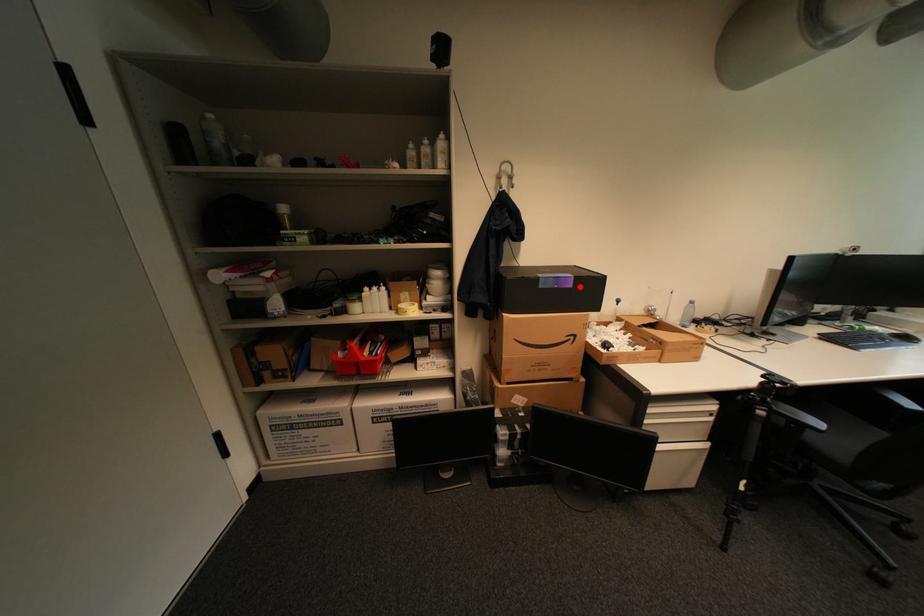
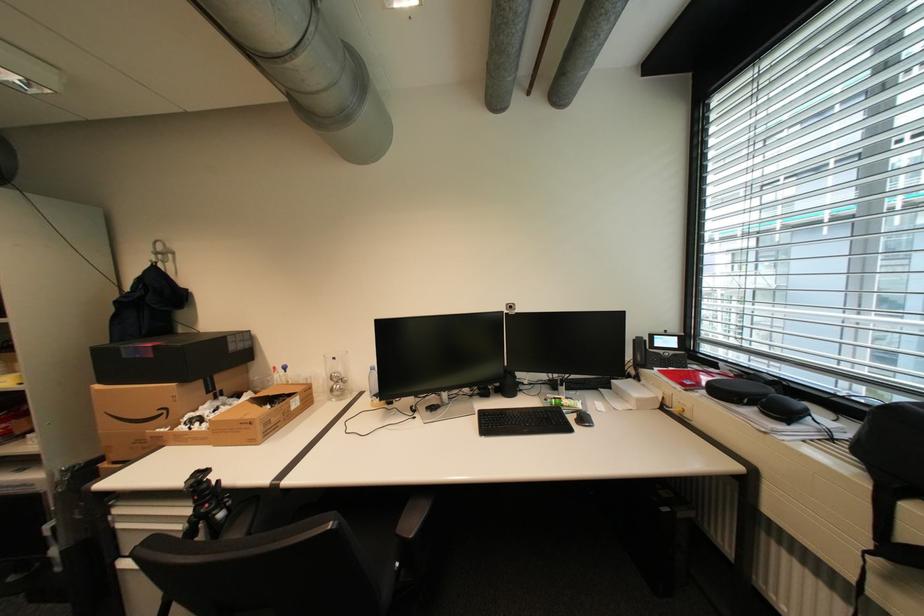
Where in the second image is the point corresponding to the highlighted location from the first image?

(161, 357)